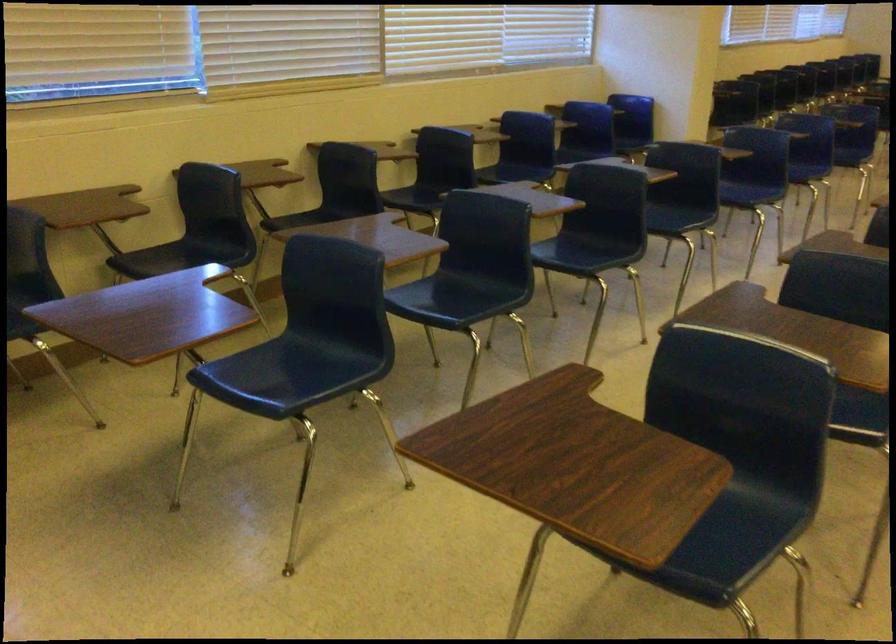
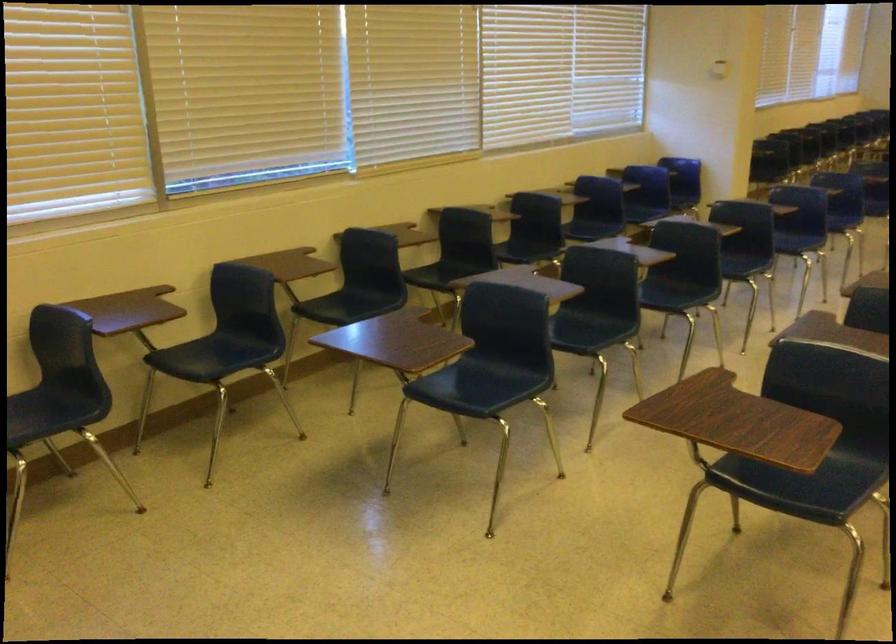
Where in the second image is the point corresponding to (197,261) from the first image?

(359, 303)